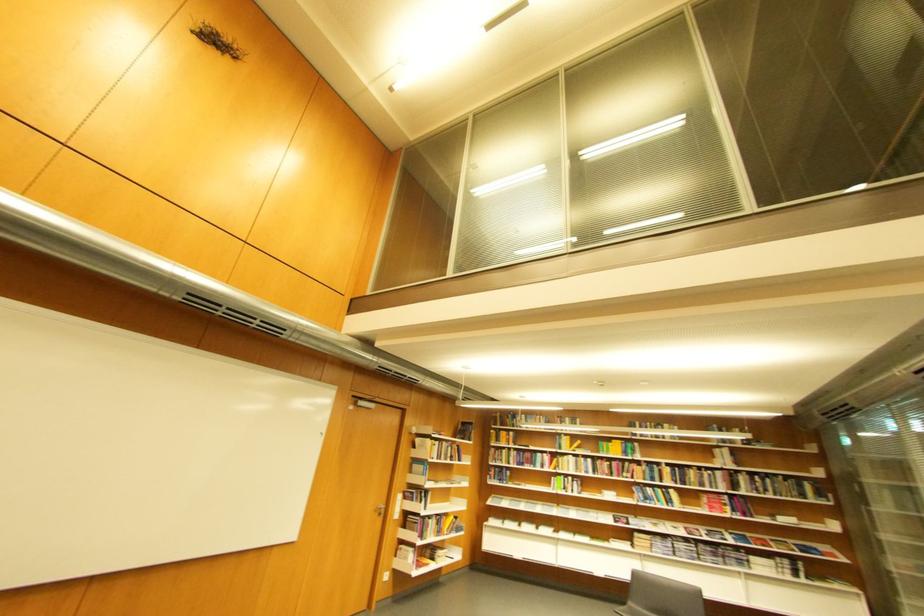
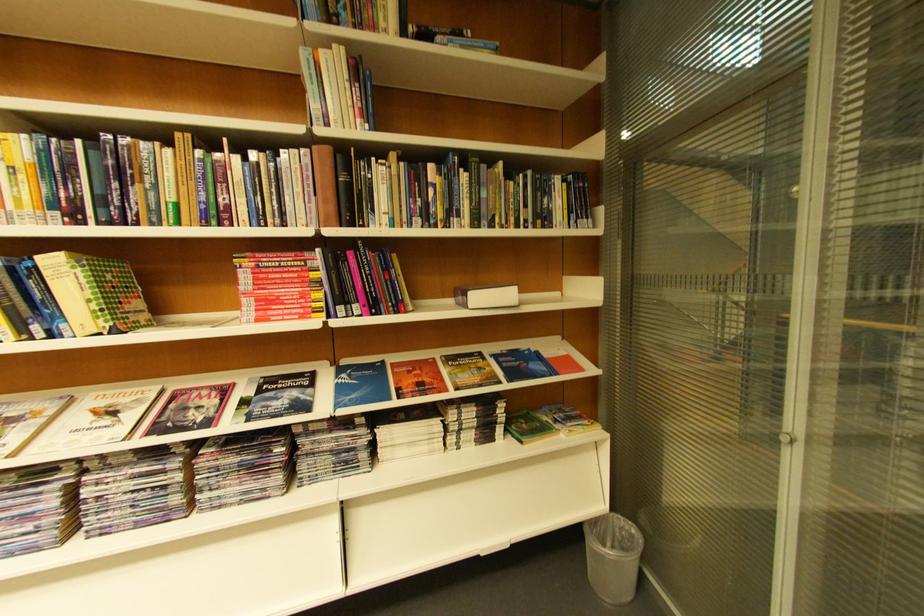
Locate, in the second image, the point that corresponds to the point at 749,516 in the first image.

(367, 310)